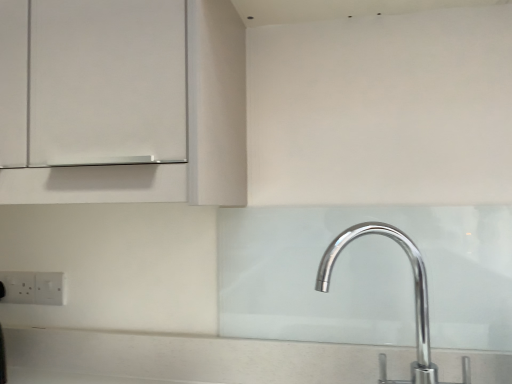
Question: In terms of height, does white plastic electric outlet at lower left, which ranks as the first electric outlet in right-to-left order, look taller or shorter compared to polished chrome tap at lower right?

Choices:
 (A) tall
 (B) short

Answer: (B)

Question: Would you say white plastic electric outlet at lower left, acting as the second electric outlet starting from the left, is to the left or to the right of polished chrome tap at lower right in the picture?

Choices:
 (A) left
 (B) right

Answer: (A)

Question: Which is farther from the polished chrome tap at lower right?

Choices:
 (A) white plastic electric outlet at lower left, marked as the first electric outlet in a left-to-right arrangement
 (B) white plastic electric outlet at lower left, acting as the second electric outlet starting from the left

Answer: (A)

Question: Based on their relative distances, which object is farther from the white plastic electric outlet at lower left, acting as the second electric outlet starting from the left?

Choices:
 (A) polished chrome tap at lower right
 (B) white plastic electric outlet at lower left, marked as the 2th electric outlet in a right-to-left arrangement

Answer: (A)